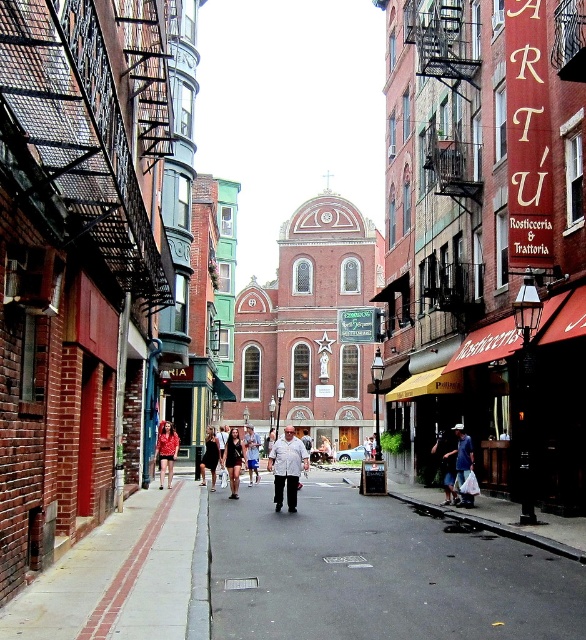
You are standing on the street looking at the church. There is black asphalt at center and dark blue jeans at center in your view. Which one is nearer to you?

The black asphalt at center is closer to the viewer than the dark blue jeans at center.

You are a photographer standing in the middle of the street, facing the grand red brick church. You notice a black dress at center and dark blue jeans at center. Which clothing item is positioned more to the right from your viewpoint?

The black dress at center is positioned more to the right from your viewpoint because it is to the right of the dark blue jeans at center according to the description.